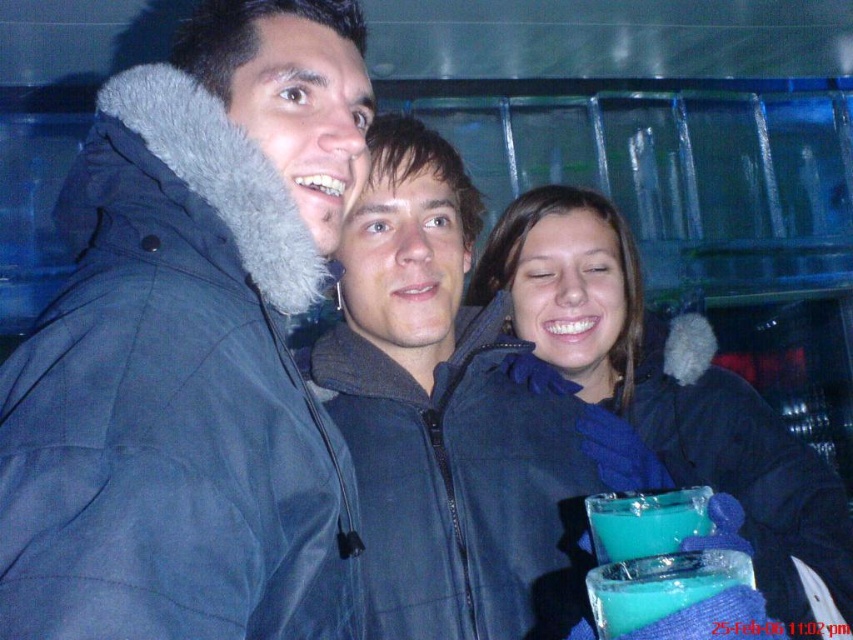
You are standing at the origin point of the coordinate system where the image is represented. The dark blue puffy jacket at left is located at point [192,349]. If you want to move towards the dark blue puffy jacket at left, in which direction should you move? The coordinate system has the origin at the bottom left corner of the image, with the x and y axes increasing to the right and upwards respectively.

To move towards the dark blue puffy jacket at left located at point [192,349] from the origin, you should move in the northeast direction, which is both to the right and upwards.

You are trying to decide which item to grab first from the scene to keep warm. The dark blue puffy jacket at left and the blue fleece scarf at center are both visible. Which item is physically smaller in size?

The dark blue puffy jacket at left is smaller than the blue fleece scarf at center, so you should grab the jacket first if you want a smaller item.

You are standing in front of the group photo and want to know which object is nearer to you between the dark blue puffy jacket at left and the blue fleece scarf at center. Can you determine this?

The dark blue puffy jacket at left is closer to the viewer than the blue fleece scarf at center.